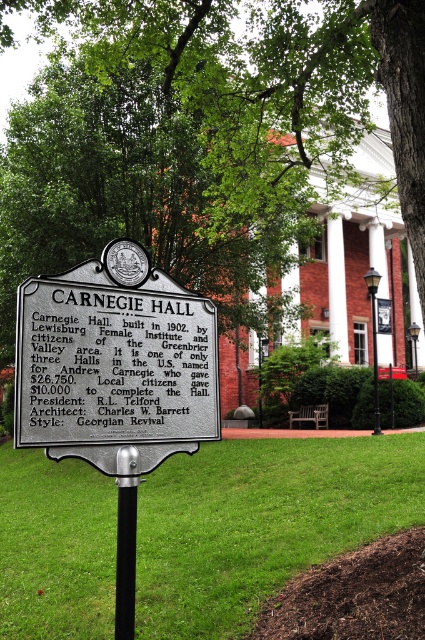
Which is behind, point (116, 74) or point (178, 307)?

Positioned behind is point (116, 74).

From the picture: Between green leafy tree at upper center and silver metallic sign at center-left, which one has more height?

Standing taller between the two is green leafy tree at upper center.

Describe the element at coordinates (206, 138) in the screenshot. I see `green leafy tree at upper center` at that location.

I want to click on green leafy tree at upper center, so click(x=206, y=138).

Between green grass at center and silver metallic sign at center-left, which one has more height?

green grass at center is taller.

Which is more to the right, green grass at center or silver metallic sign at center-left?

green grass at center is more to the right.

Is point (370, 442) positioned behind point (98, 426)?

Yes, it is behind point (98, 426).

The height and width of the screenshot is (640, 425). I want to click on green grass at center, so click(x=260, y=522).

Between green grass at center and black metal pole at center, which one appears on the right side from the viewer's perspective?

green grass at center is more to the right.

Who is taller, green grass at center or black metal pole at center?

Standing taller between the two is green grass at center.

Is point (187, 552) less distant than point (132, 476)?

No, (187, 552) is further to viewer.

This screenshot has width=425, height=640. Find the location of `green grass at center`. green grass at center is located at coordinates click(x=260, y=522).